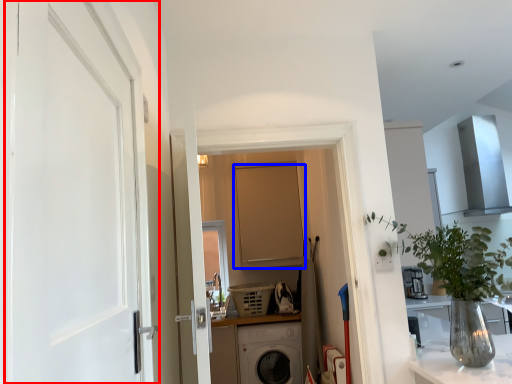
Question: Which of the following is the closest to the observer, door (highlighted by a red box) or door (highlighted by a blue box)?

Choices:
 (A) door
 (B) door

Answer: (A)